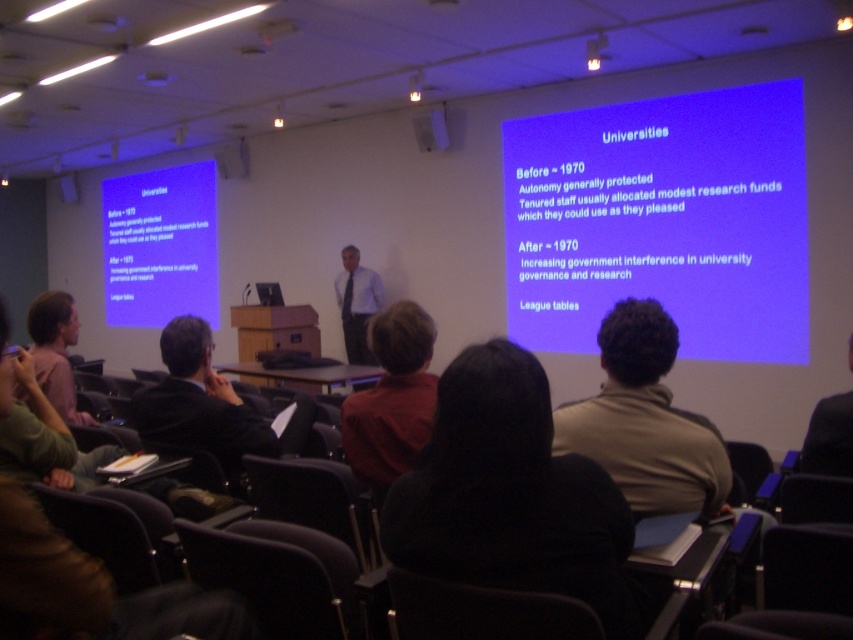
You are a person with a height of 1.7 meters standing in the lecture hall. You see the brown fleece jacket at center. Can you reach it if you stretch your hand forward?

The brown fleece jacket at center is 1.69 meters from viewer. Since your height is 1.7 meters, when you stretch your hand forward, your fingertips can reach approximately 1.6 to 1.7 meters. Therefore, you can just barely reach the brown fleece jacket at center.

You are sitting in the front row of the lecture hall and see two points marked on the floor. The first point is at coordinate point (39, 294) and the second is at point (339, 292). Which point is closer to you?

Result: Point (39, 294) is closer to you because it is further to the camera than point (339, 292).

You are an attendee in the lecture hall and want to know which object is closer to the front of the room between the brown fleece jacket at center and the light brown hair at lower left. Based on their heights, can you determine which one is closer?

The brown fleece jacket at center is shorter than the light brown hair at lower left. Since objects closer to the front of the room appear taller in the image, the light brown hair at lower left is closer to the front.